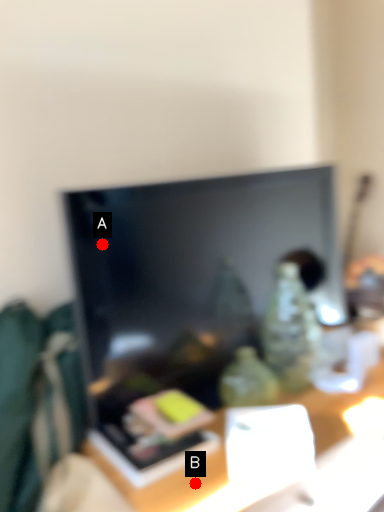
Question: Two points are circled on the image, labeled by A and B beside each circle. Which point is farther to the camera?

Choices:
 (A) A is further
 (B) B is further

Answer: (A)